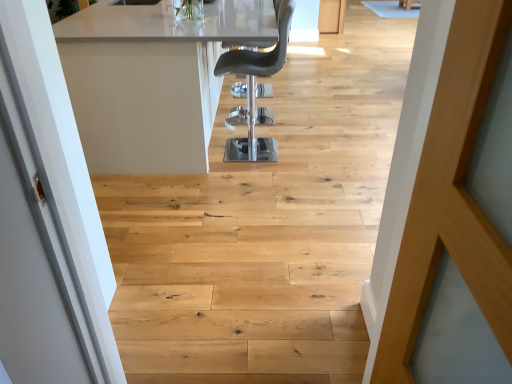
Question: Considering the positions of white glossy table at center and black leather chair at center in the image, is white glossy table at center bigger or smaller than black leather chair at center?

Choices:
 (A) big
 (B) small

Answer: (A)

Question: From the image's perspective, is white glossy table at center positioned above or below black leather chair at center?

Choices:
 (A) below
 (B) above

Answer: (B)

Question: Relative to black leather chair at center, is white glossy table at center in front or behind?

Choices:
 (A) front
 (B) behind

Answer: (A)

Question: From a real-world perspective, is black leather chair at center physically located above or below white glossy table at center?

Choices:
 (A) above
 (B) below

Answer: (A)

Question: Considering the positions of point (279, 34) and point (202, 117), is point (279, 34) closer or farther from the camera than point (202, 117)?

Choices:
 (A) closer
 (B) farther

Answer: (B)

Question: Considering the positions of black leather chair at center and white glossy table at center in the image, is black leather chair at center wider or thinner than white glossy table at center?

Choices:
 (A) thin
 (B) wide

Answer: (A)

Question: Considering their positions, is black leather chair at center located in front of or behind white glossy table at center?

Choices:
 (A) front
 (B) behind

Answer: (B)